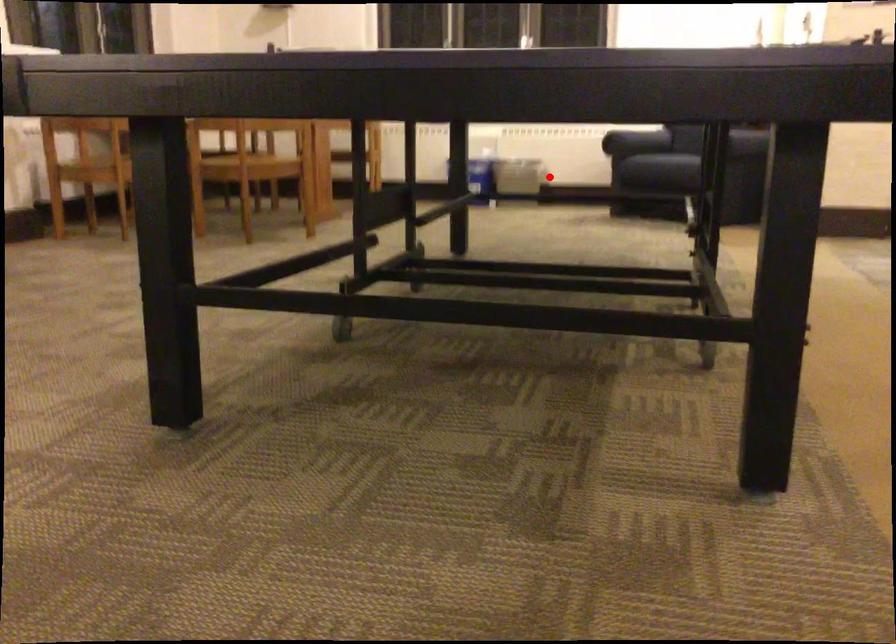
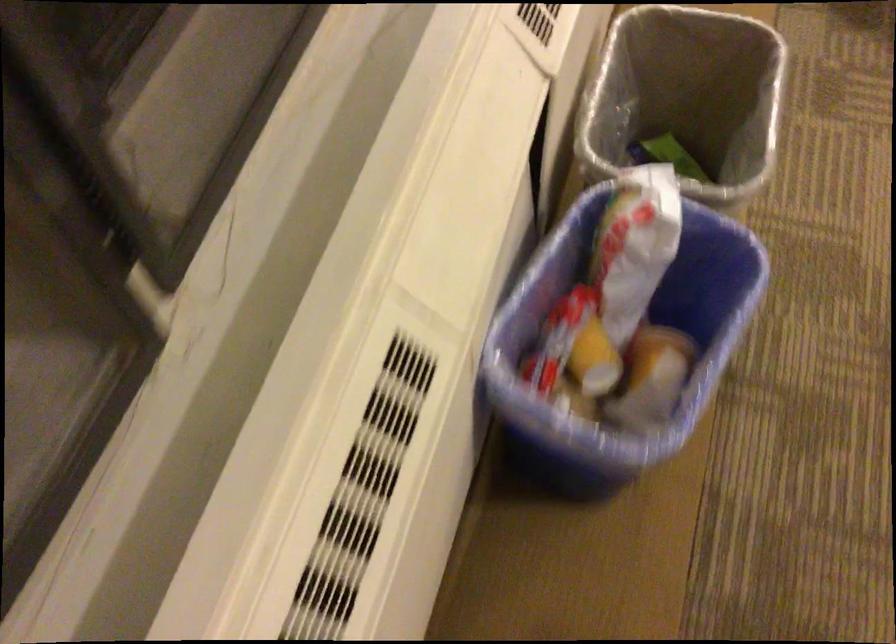
Find the pixel in the second image that matches the highlighted location in the first image.

(686, 97)